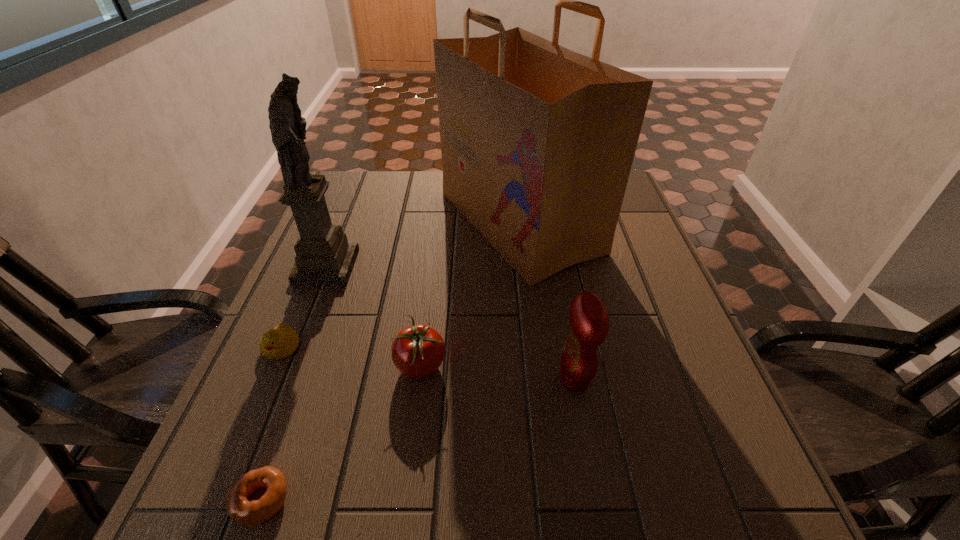
Where is `duckling located at the left edge`? This screenshot has height=540, width=960. duckling located at the left edge is located at coordinates (282, 341).

At what (x,y) coordinates should I click in order to perform the action: click on doughnut present at the left edge. Please return your answer as a coordinate pair (x, y). The image size is (960, 540). Looking at the image, I should click on (249, 513).

This screenshot has width=960, height=540. In order to click on object positioned at the right edge in this screenshot , I will do `click(537, 141)`.

The image size is (960, 540). I want to click on object located at the near left corner, so click(249, 513).

Where is `object positioned at the far right corner`? Image resolution: width=960 pixels, height=540 pixels. object positioned at the far right corner is located at coordinates (537, 141).

At what (x,y) coordinates should I click in order to perform the action: click on vacant region at the near edge of the desktop. Please return your answer as a coordinate pair (x, y). Looking at the image, I should click on (333, 505).

At what (x,y) coordinates should I click in order to perform the action: click on free spot at the left edge of the desktop. Please return your answer as a coordinate pair (x, y). Image resolution: width=960 pixels, height=540 pixels. Looking at the image, I should click on [242, 417].

Image resolution: width=960 pixels, height=540 pixels. What are the coordinates of `vacant region at the right edge` in the screenshot? It's located at (622, 352).

Identify the location of vacant space at the far left corner. The image size is (960, 540). (353, 199).

Image resolution: width=960 pixels, height=540 pixels. What are the coordinates of `vacant area that lies between the tomato and the sculpture` in the screenshot? It's located at (373, 316).